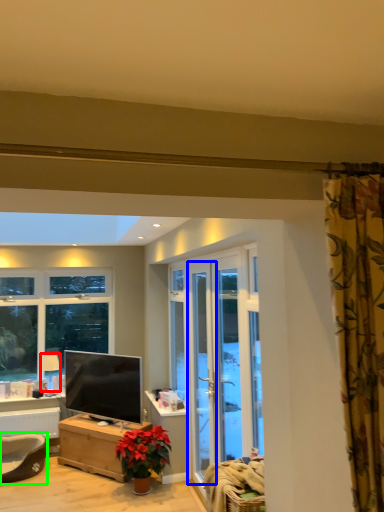
Question: Which is nearer to the lamp (highlighted by a red box)? screen door (highlighted by a blue box) or swivel chair (highlighted by a green box).

Choices:
 (A) screen door
 (B) swivel chair

Answer: (B)